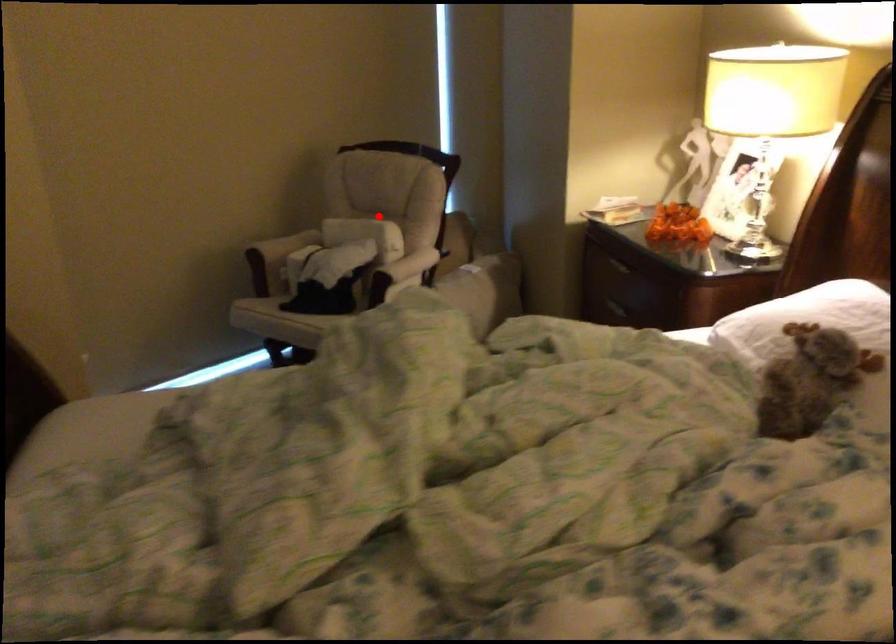
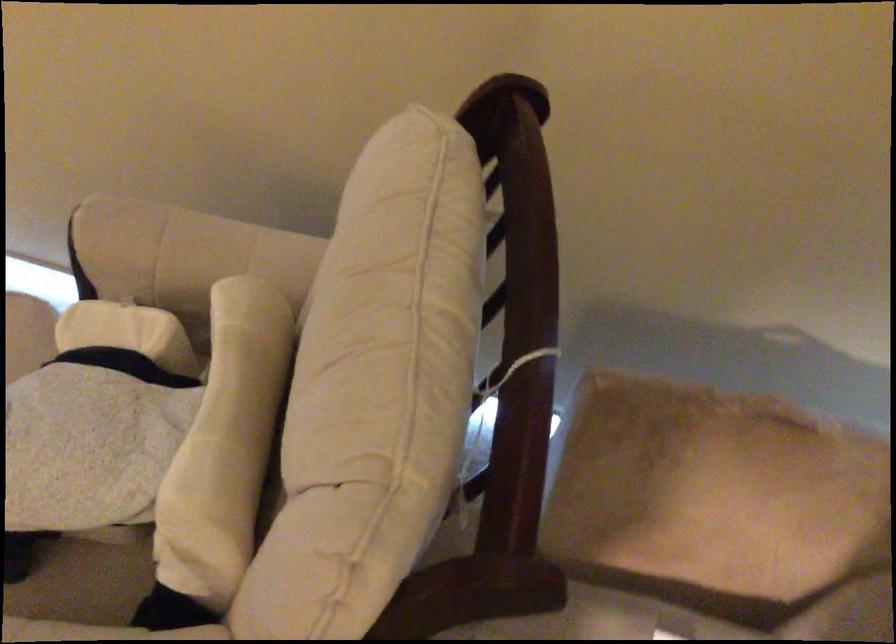
Question: A red point is marked in image1. In image2, is the corresponding 3D point closer to the camera or farther? Reply with the corresponding letter.

Choices:
 (A) The corresponding 3D point is closer.
 (B) The corresponding 3D point is farther.

Answer: (A)